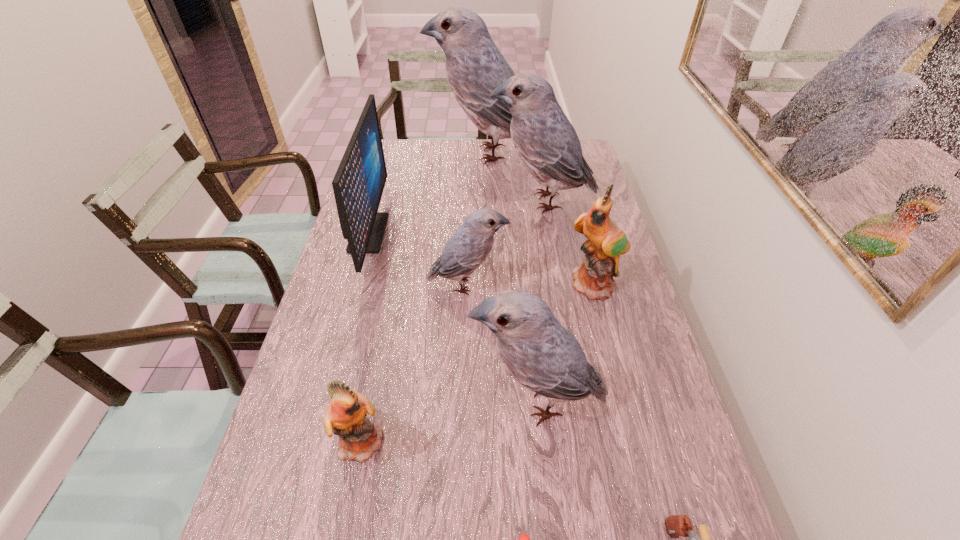
Where is `free spot located 0.200m on the front-facing side of the second smallest gray parrot`? The image size is (960, 540). free spot located 0.200m on the front-facing side of the second smallest gray parrot is located at coordinates (384, 401).

Where is `free space located on the front-facing side of the second smallest gray parrot`? The width and height of the screenshot is (960, 540). free space located on the front-facing side of the second smallest gray parrot is located at coordinates (307, 401).

Identify the location of free location located 0.230m on the front-facing side of the second smallest gray parrot. (372, 401).

Where is `free spot located on the front-facing side of the left green parrot`? This screenshot has height=540, width=960. free spot located on the front-facing side of the left green parrot is located at coordinates (488, 440).

The width and height of the screenshot is (960, 540). I want to click on vacant space located on the front-facing side of the smallest gray parrot, so click(x=558, y=285).

This screenshot has height=540, width=960. In order to click on object that is at the far edge in this screenshot , I will do `click(474, 66)`.

Locate an element on the screen. The width and height of the screenshot is (960, 540). computer monitor at the left edge is located at coordinates (358, 184).

Locate an element on the screen. Image resolution: width=960 pixels, height=540 pixels. parrot located at the left edge is located at coordinates (345, 416).

The height and width of the screenshot is (540, 960). Find the location of `vacant space at the far edge of the desktop`. vacant space at the far edge of the desktop is located at coordinates (417, 168).

Where is `vacant space at the left edge`? The image size is (960, 540). vacant space at the left edge is located at coordinates tap(344, 281).